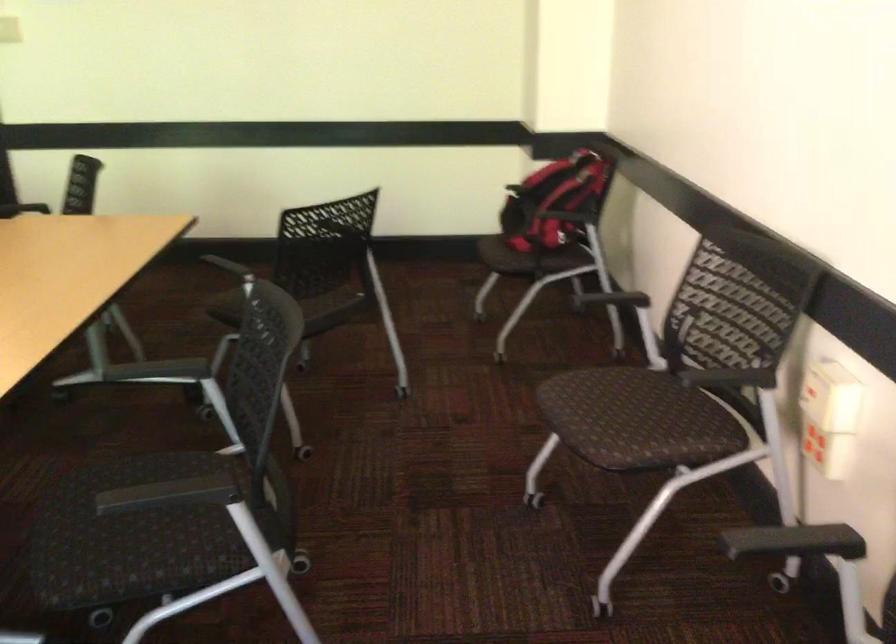
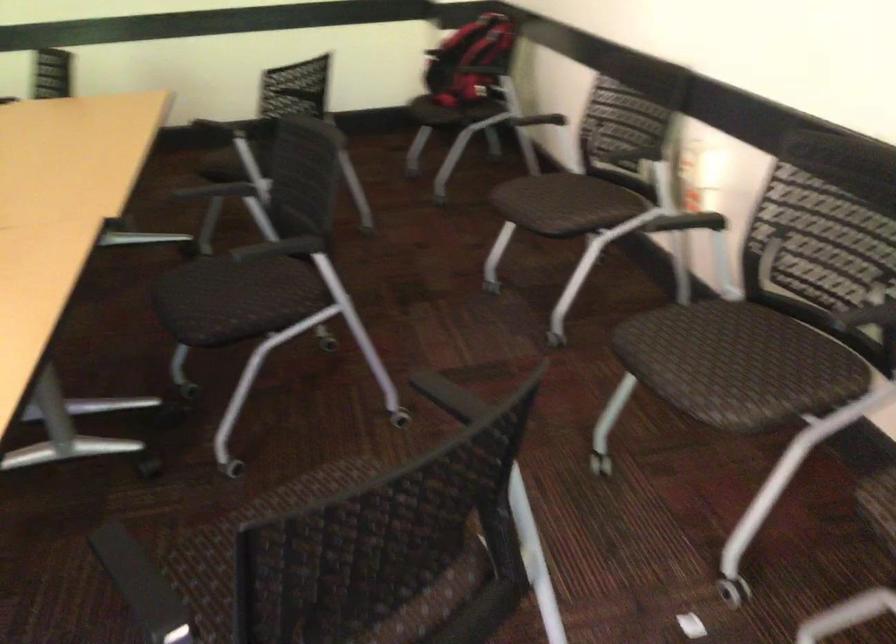
Where in the second image is the point corresponding to point (657, 442) from the first image?

(581, 207)